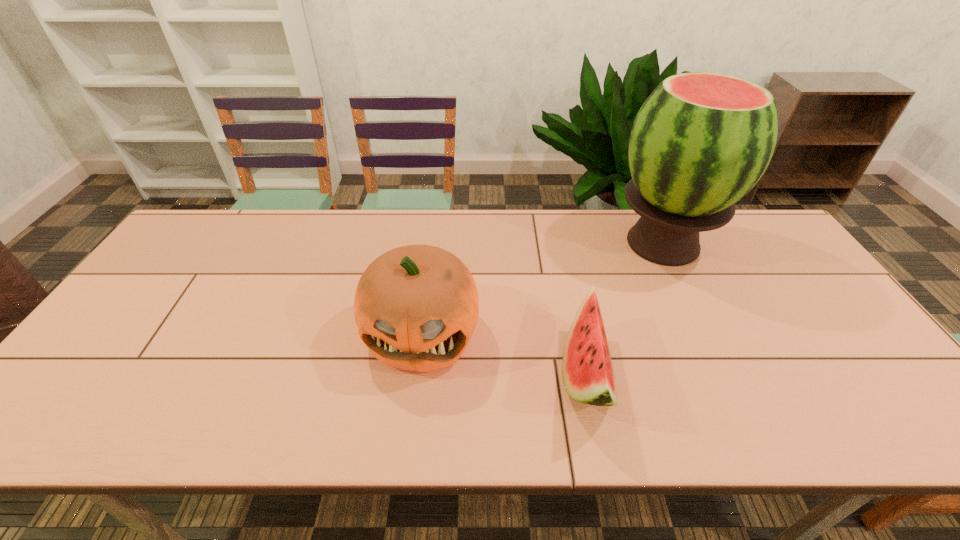
Locate which object ranks in proximity to the left watermelon. Please provide its 2D coordinates. Your answer should be formatted as a tuple, i.e. [(x, y)], where the tuple contains the x and y coordinates of a point satisfying the conditions above.

[(701, 141)]